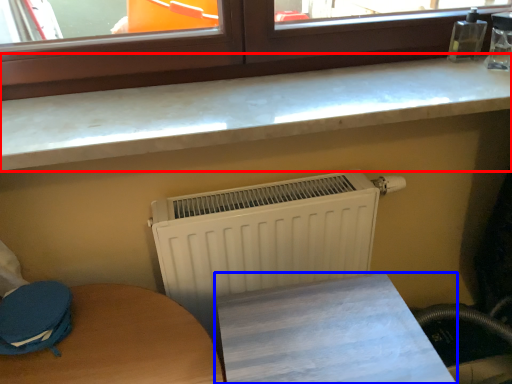
Question: Among these objects, which one is farthest to the camera, countertop (highlighted by a red box) or furniture (highlighted by a blue box)?

Choices:
 (A) countertop
 (B) furniture

Answer: (A)